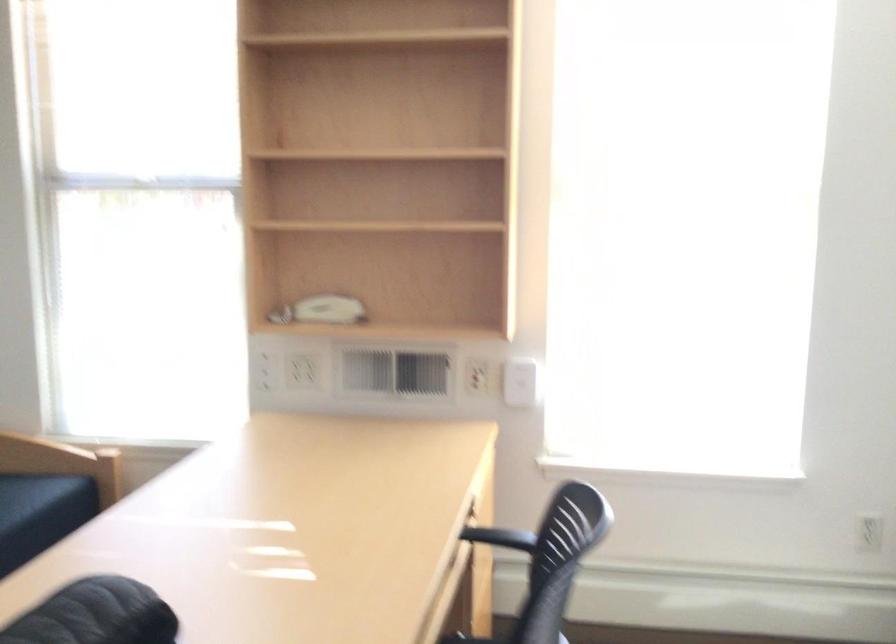
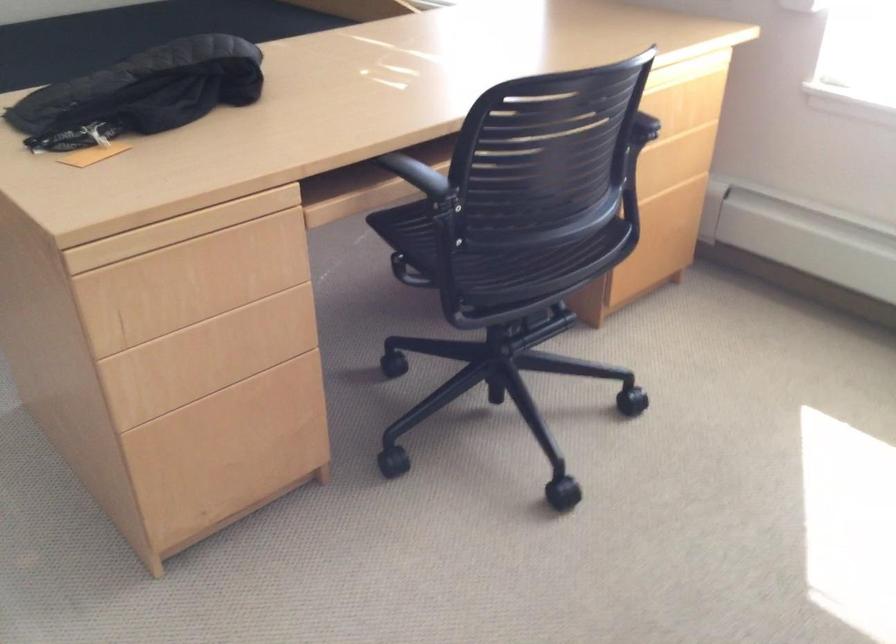
Locate, in the second image, the point that corresponds to point 478,551 in the first image.

(640, 143)